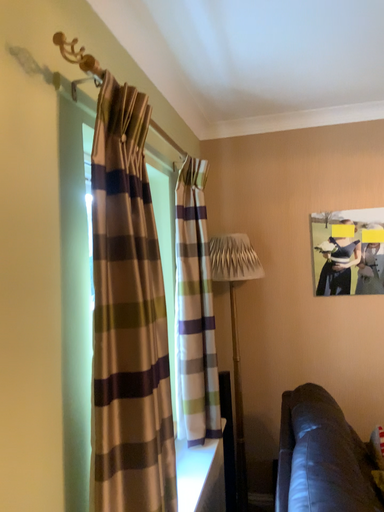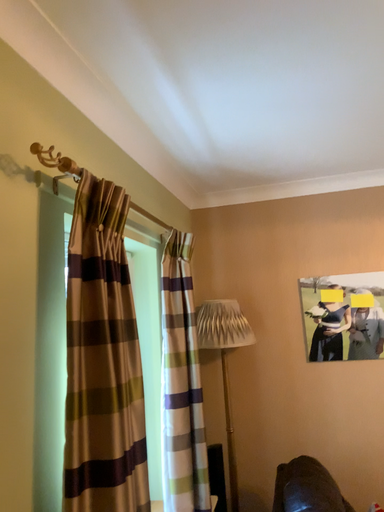
Question: How did the camera likely rotate when shooting the video?

Choices:
 (A) rotated downward
 (B) rotated upward

Answer: (B)